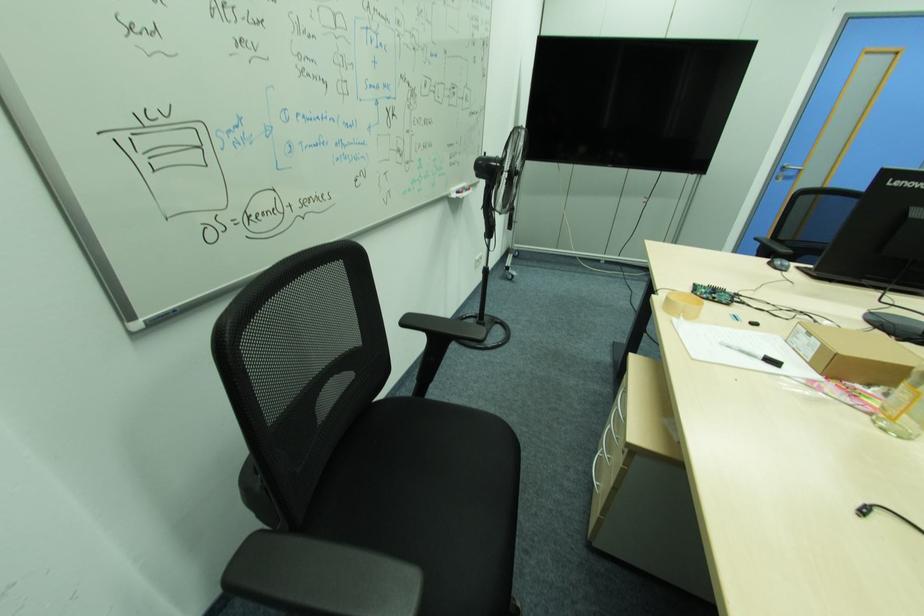
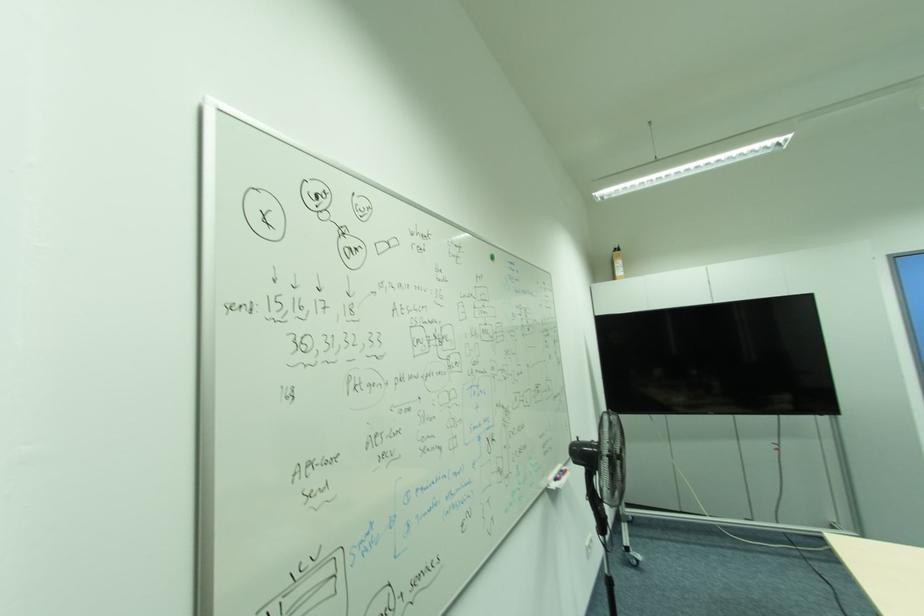
Question: I am providing you with two images of the same scene from different viewpoints. Which of the following objects are not visible in image2?

Choices:
 (A) fan stand wheels
 (B) bottle pump top
 (C) red whiteboard marker
 (D) none of these

Answer: (D)